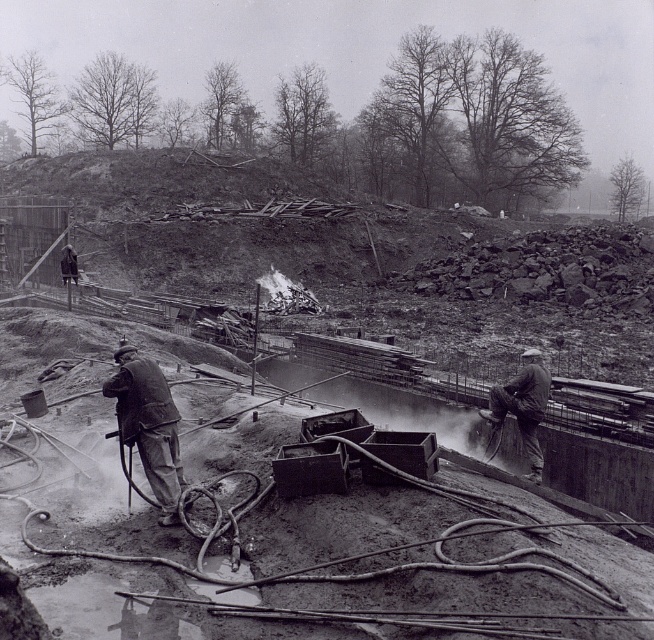
You are a construction worker standing at point (148,424) on the image. You need to move to the nearest object which is a matte gray jacket at center. Can you reach it without crossing any obstacles?

The matte gray jacket at center is located exactly at your current position, so you are already at the matte gray jacket at center and can reach it immediately without moving.

You are observing two workers at a construction site. You notice both are wearing matte gray jackets. Which worker, the one wearing the matte gray jacket at center or the one wearing the matte gray jacket at right, is standing closer to you?

The matte gray jacket at center is taller than the matte gray jacket at right, which means the worker wearing the matte gray jacket at center is closer to you since objects closer to the viewer appear larger.